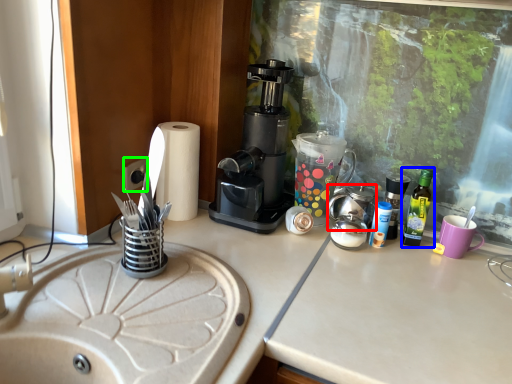
Question: Estimate the real-world distances between objects in this image. Which object is farther from appliance (highlighted by a red box), bottle (highlighted by a blue box) or electric outlet (highlighted by a green box)?

Choices:
 (A) bottle
 (B) electric outlet

Answer: (B)